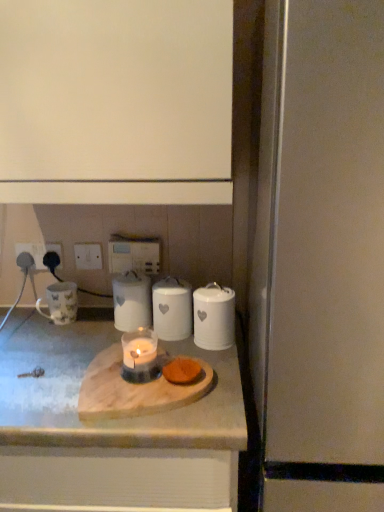
Identify the location of free space behind orange sponge at center. (186, 347).